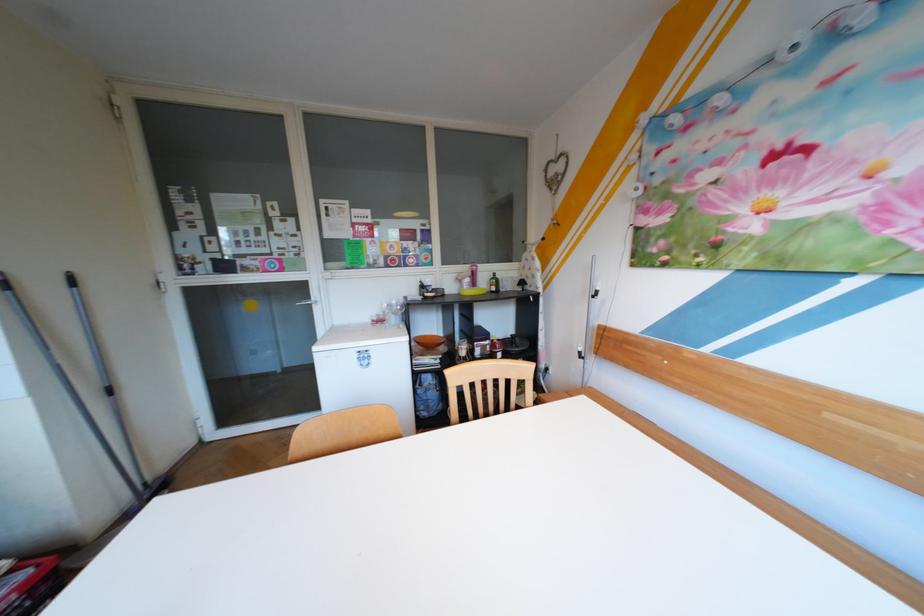
Identify the location of white door handle. (589, 323).